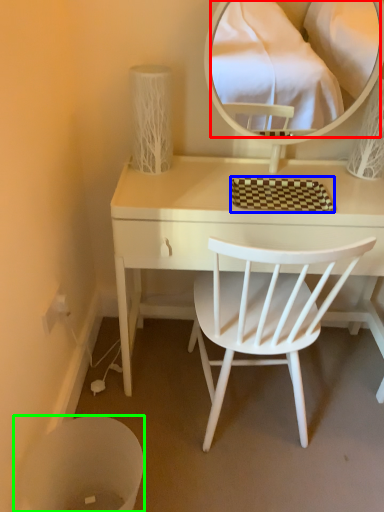
Question: Considering the real-world distances, which object is farthest from mirror (highlighted by a red box)? mat (highlighted by a blue box) or trash bin/can (highlighted by a green box)?

Choices:
 (A) mat
 (B) trash bin/can

Answer: (B)